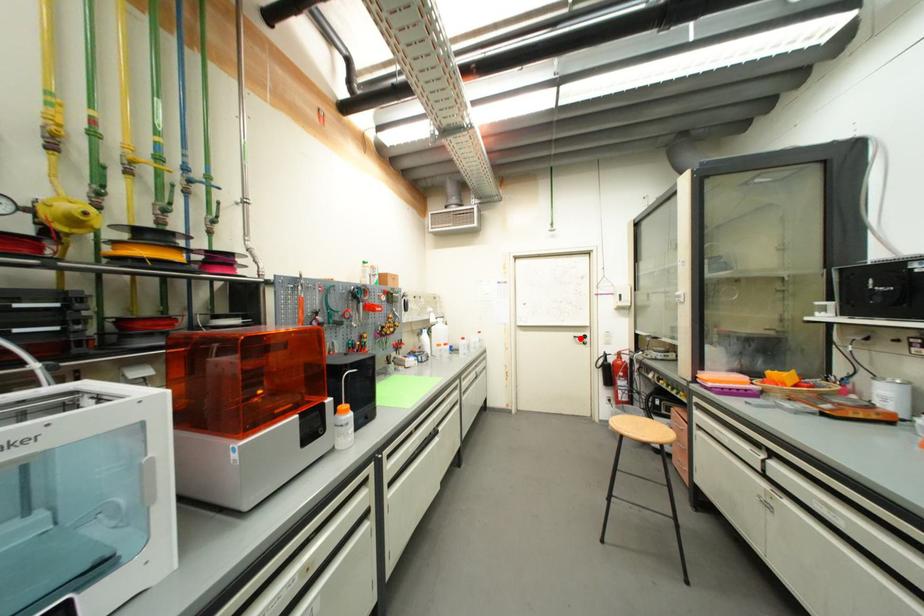
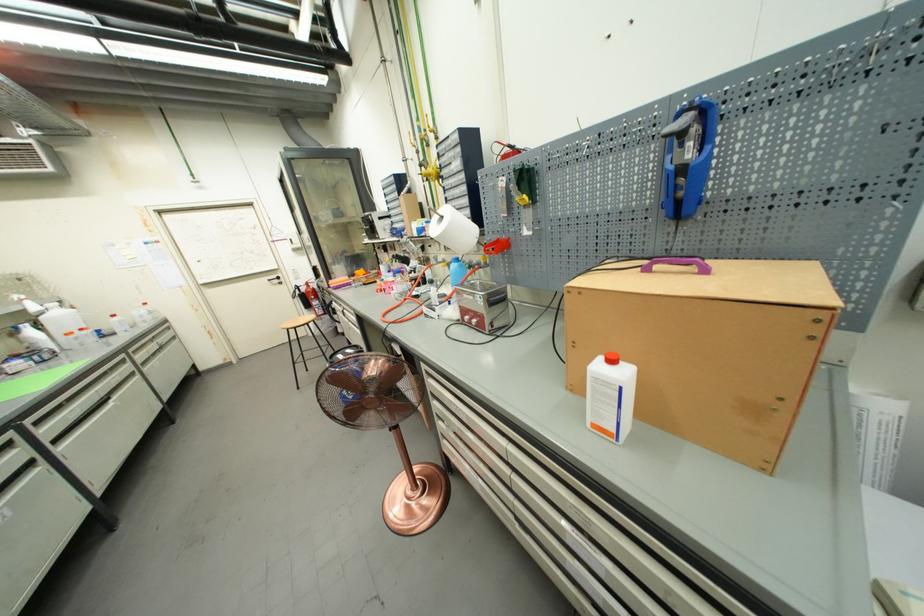
Where in the second image is the point corresponding to the highlighted location from the first image?

(274, 282)